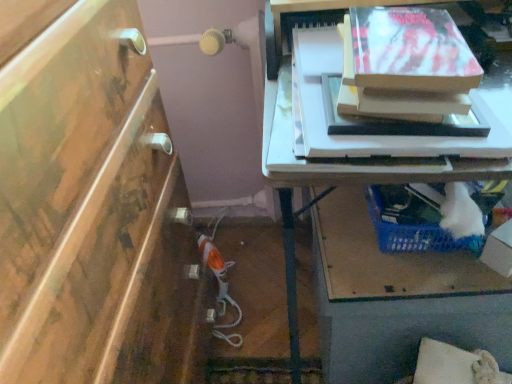
Question: From the image's perspective, is white cardboard box at lower right located beneath blue plastic basket at lower right?

Choices:
 (A) yes
 (B) no

Answer: (B)

Question: Is white cardboard box at lower right aimed at blue plastic basket at lower right?

Choices:
 (A) no
 (B) yes

Answer: (A)

Question: From a real-world perspective, does white cardboard box at lower right stand above blue plastic basket at lower right?

Choices:
 (A) no
 (B) yes

Answer: (B)

Question: Is white cardboard box at lower right not inside blue plastic basket at lower right?

Choices:
 (A) yes
 (B) no

Answer: (A)

Question: Is white cardboard box at lower right in contact with blue plastic basket at lower right?

Choices:
 (A) no
 (B) yes

Answer: (A)

Question: Is blue plastic basket at lower right located within white cardboard box at lower right?

Choices:
 (A) no
 (B) yes

Answer: (A)

Question: Considering the relative positions of blue plastic basket at lower right and matte cardboard box at upper right in the image provided, is blue plastic basket at lower right in front of matte cardboard box at upper right?

Choices:
 (A) no
 (B) yes

Answer: (A)

Question: Does blue plastic basket at lower right turn towards matte cardboard box at upper right?

Choices:
 (A) yes
 (B) no

Answer: (B)

Question: Is blue plastic basket at lower right oriented away from matte cardboard box at upper right?

Choices:
 (A) no
 (B) yes

Answer: (A)

Question: Is blue plastic basket at lower right beside matte cardboard box at upper right?

Choices:
 (A) yes
 (B) no

Answer: (B)

Question: Can you confirm if blue plastic basket at lower right is smaller than matte cardboard box at upper right?

Choices:
 (A) yes
 (B) no

Answer: (B)

Question: Can you confirm if blue plastic basket at lower right is taller than matte cardboard box at upper right?

Choices:
 (A) no
 (B) yes

Answer: (B)

Question: Is white cardboard box at lower right further to camera compared to matte cardboard box at upper right?

Choices:
 (A) no
 (B) yes

Answer: (B)